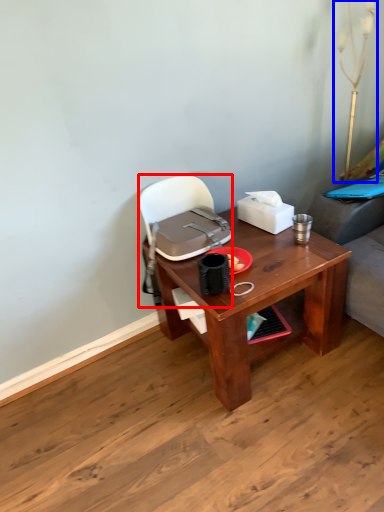
Question: Which of the following is the closest to the observer, handbag (highlighted by a red box) or table lamp (highlighted by a blue box)?

Choices:
 (A) handbag
 (B) table lamp

Answer: (A)